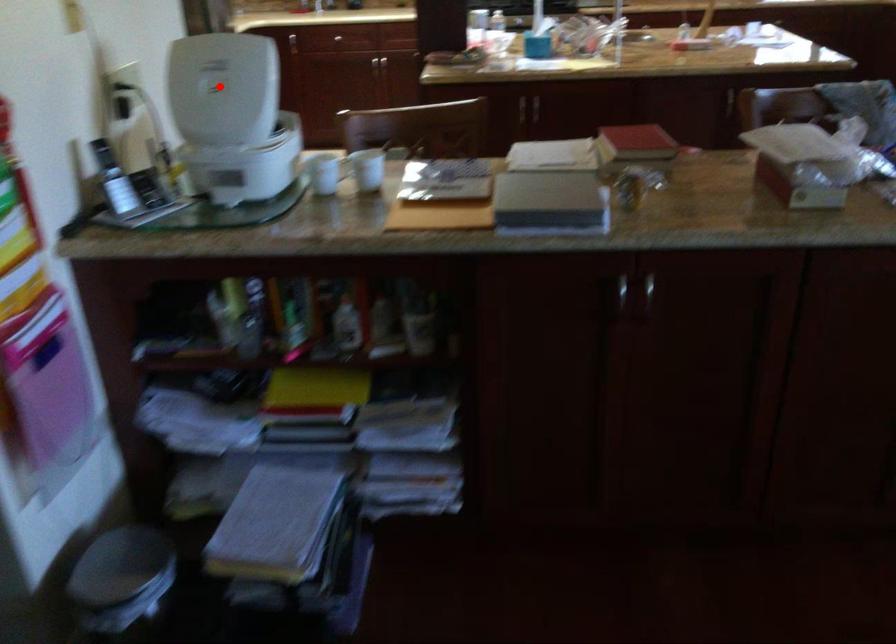
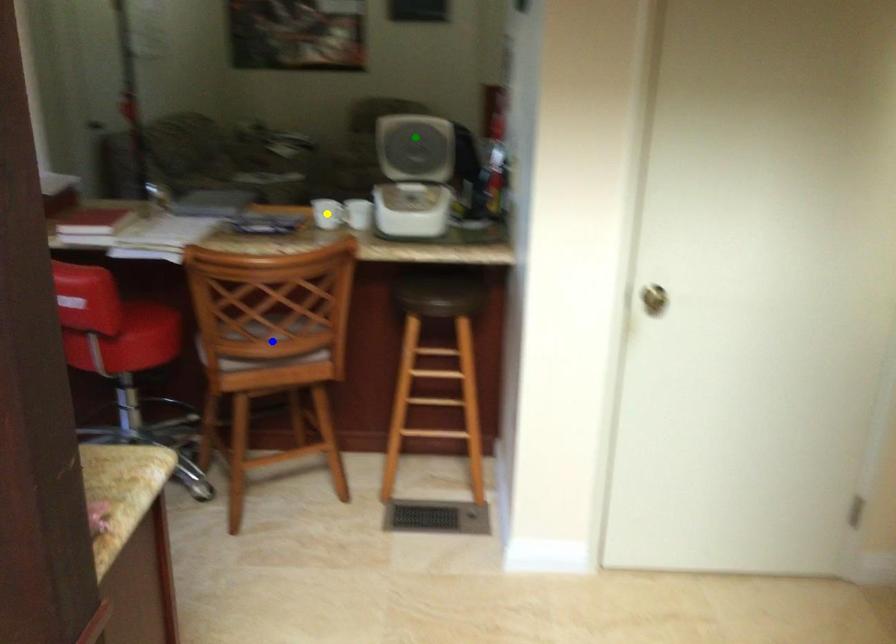
Question: I am providing you with two images of the same scene from different viewpoints. A red point is marked on the first image. You are given multiple points on the second image. In image 2, which mark is for the same physical point as the one in image 1?

Choices:
 (A) green point
 (B) yellow point
 (C) blue point

Answer: (A)